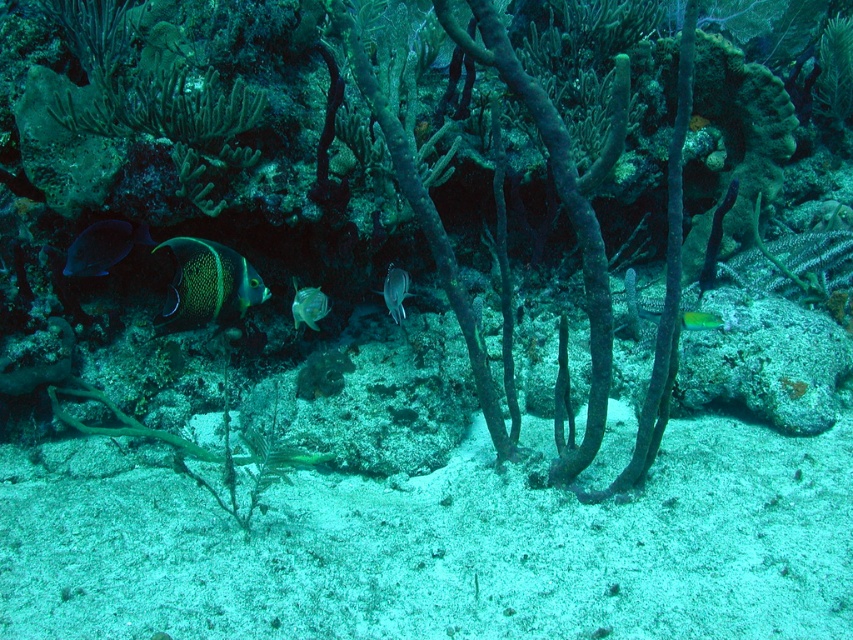
You are a snorkeler observing the underwater scene. You see a shiny blue fish at center and a green iridescent fish at center. Which fish is closer to you?

The shiny blue fish at center is closer to you because it is further to the viewer than the green iridescent fish at center.

You are a marine biologist observing an underwater coral reef scene. You notice a matte blue fish at left and a translucent glass fish at center. Which fish has a greater width?

The matte blue fish at left has a greater width than the translucent glass fish at center.